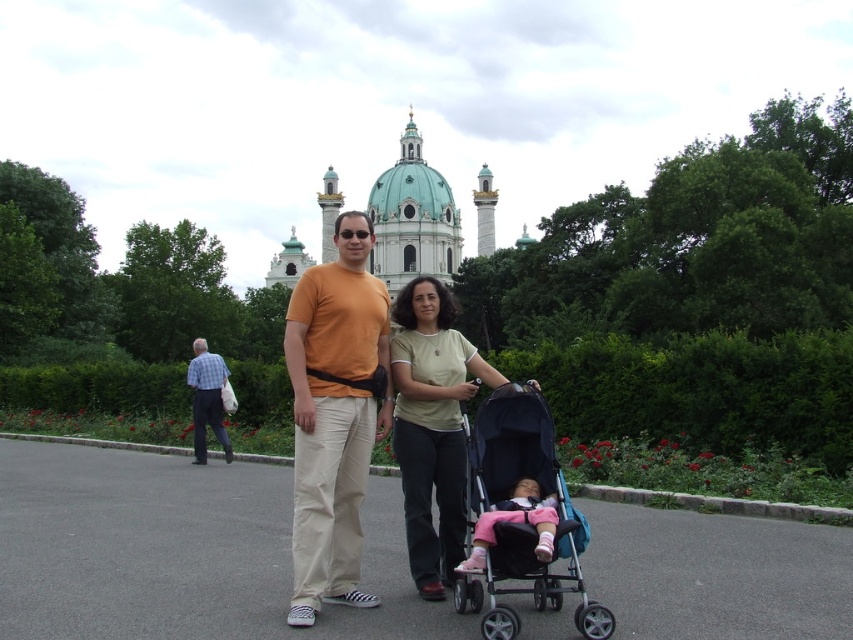
Does white marble palace at center have a greater width compared to pink fabric baby carriage at center?

Yes.

In the scene shown: Does white marble palace at center have a larger size compared to pink fabric baby carriage at center?

Indeed, white marble palace at center has a larger size compared to pink fabric baby carriage at center.

Who is more forward, (387, 240) or (547, 518)?

Positioned in front is point (547, 518).

The height and width of the screenshot is (640, 853). I want to click on white marble palace at center, so click(x=412, y=218).

Based on the photo, who is positioned more to the left, black fabric stroller at center or pink fabric baby carriage at center?

Positioned to the left is pink fabric baby carriage at center.

Which is behind, point (476, 445) or point (505, 518)?

Positioned behind is point (476, 445).

Where is `black fabric stroller at center`? The width and height of the screenshot is (853, 640). black fabric stroller at center is located at coordinates pyautogui.click(x=520, y=516).

Is the position of matte orange t-shirt at center more distant than that of blue plaid shirt at left?

That is False.

Is point (375, 596) more distant than point (206, 346)?

That is False.

Identify the location of matte orange t-shirt at center. Image resolution: width=853 pixels, height=640 pixels. (334, 416).